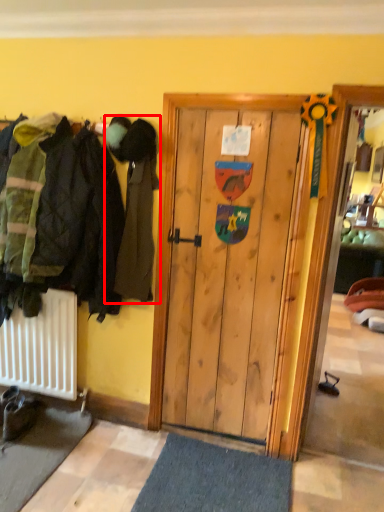
Question: From the image's perspective, what is the correct spatial relationship of person (annotated by the red box) in relation to footwear?

Choices:
 (A) below
 (B) above

Answer: (B)